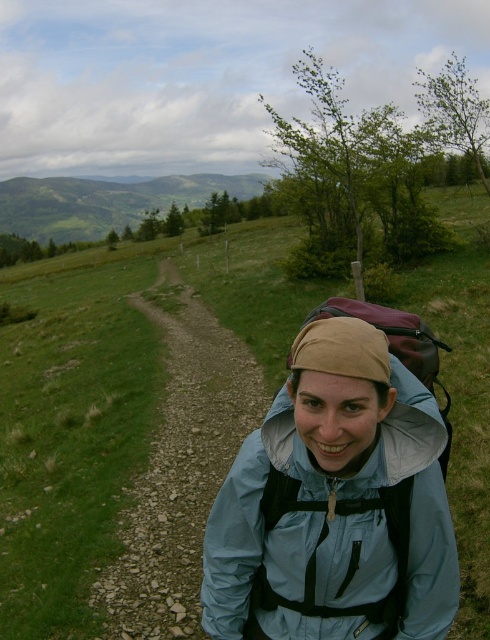
You are a hiker planning to take a photo of the light blue waterproof jacket at center and the green grassy hillside at upper left. Which object should you focus on first if you want to capture both in one shot without moving the camera?

The light blue waterproof jacket at center is shorter than the green grassy hillside at upper left, so you should focus on the light blue waterproof jacket at center first to ensure both are in focus.

You are a hiker planning to cross the path. You notice the green grassy at center and the green grassy hillside at upper left. Which area has taller grass?

The green grassy hillside at upper left has taller grass than the green grassy at center.